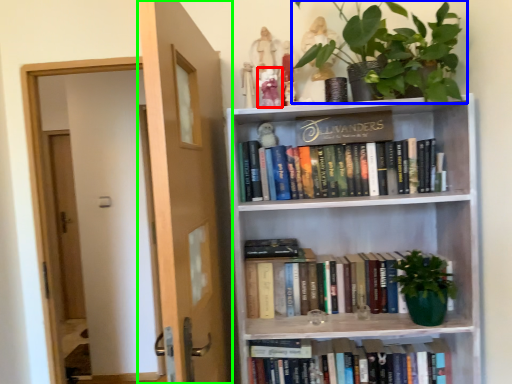
Question: Which is farther away from toy (highlighted by a red box)? houseplant (highlighted by a blue box) or door (highlighted by a green box)?

Choices:
 (A) houseplant
 (B) door

Answer: (B)